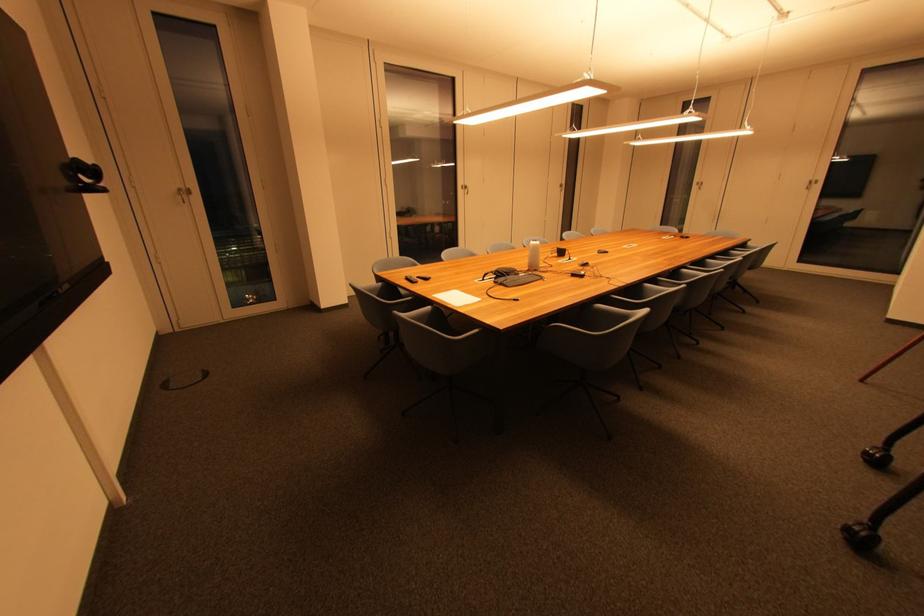
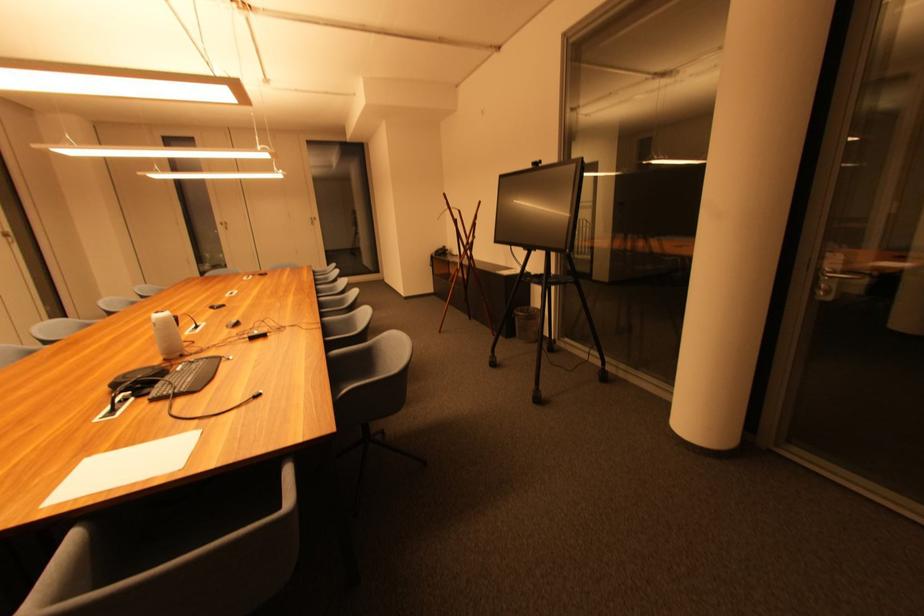
Locate, in the second image, the point that corresponds to [433,310] in the first image.

(80, 538)